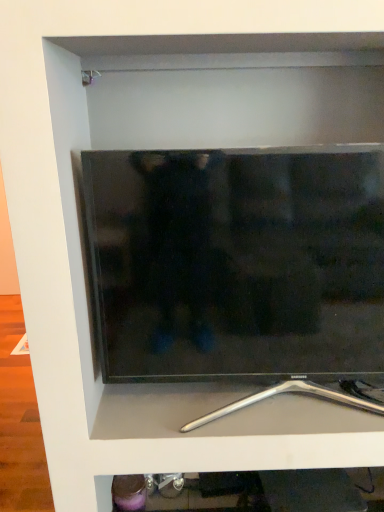
Question: Considering the relative sizes of metallic silver stand at bottom and black glossy tv at center in the image provided, is metallic silver stand at bottom wider than black glossy tv at center?

Choices:
 (A) yes
 (B) no

Answer: (A)

Question: Does metallic silver stand at bottom appear on the right side of black glossy tv at center?

Choices:
 (A) no
 (B) yes

Answer: (B)

Question: From a real-world perspective, is metallic silver stand at bottom located beneath black glossy tv at center?

Choices:
 (A) no
 (B) yes

Answer: (B)

Question: Is metallic silver stand at bottom looking in the opposite direction of black glossy tv at center?

Choices:
 (A) no
 (B) yes

Answer: (B)

Question: Is metallic silver stand at bottom oriented towards black glossy tv at center?

Choices:
 (A) no
 (B) yes

Answer: (B)

Question: Is black glossy tv at center surrounded by metallic silver stand at bottom?

Choices:
 (A) no
 (B) yes

Answer: (A)

Question: Can metallic silver stand at bottom be found inside black glossy tv at center?

Choices:
 (A) no
 (B) yes

Answer: (A)

Question: Is black glossy tv at center wider than metallic silver stand at bottom?

Choices:
 (A) no
 (B) yes

Answer: (A)

Question: Considering the relative positions of black glossy tv at center and metallic silver stand at bottom in the image provided, is black glossy tv at center to the left of metallic silver stand at bottom from the viewer's perspective?

Choices:
 (A) yes
 (B) no

Answer: (A)

Question: Does black glossy tv at center lie behind metallic silver stand at bottom?

Choices:
 (A) yes
 (B) no

Answer: (B)

Question: Does black glossy tv at center have a larger size compared to metallic silver stand at bottom?

Choices:
 (A) yes
 (B) no

Answer: (A)

Question: Would you say black glossy tv at center is a long distance from metallic silver stand at bottom?

Choices:
 (A) no
 (B) yes

Answer: (A)

Question: Is metallic silver stand at bottom inside the boundaries of black glossy tv at center, or outside?

Choices:
 (A) inside
 (B) outside

Answer: (B)